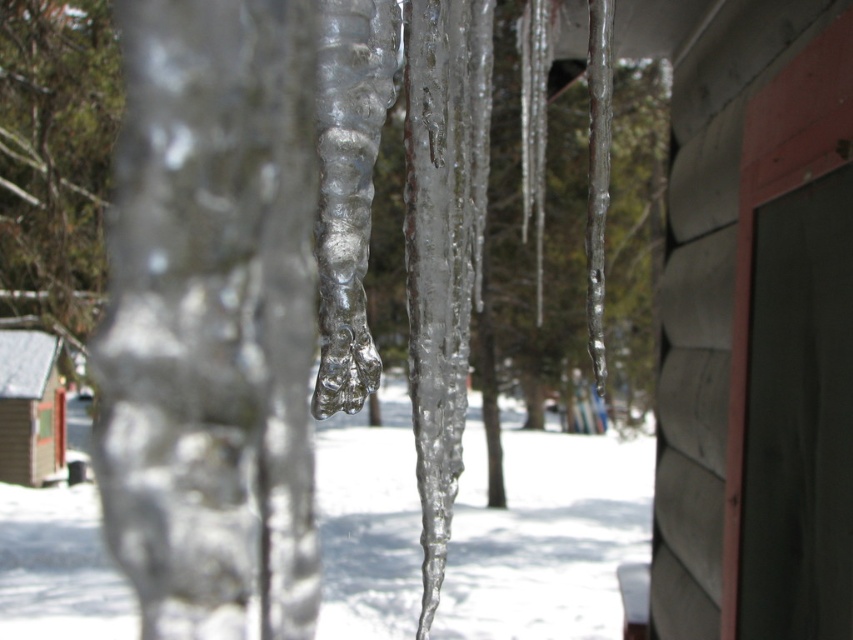
Question: Among these points, which one is nearest to the camera?

Choices:
 (A) (33, 374)
 (B) (27, 528)

Answer: (B)

Question: Among these objects, which one is nearest to the camera?

Choices:
 (A) wooden cabin at lower left
 (B) transparent ice icicles at center

Answer: (B)

Question: Is transparent ice icicles at center bigger than wooden cabin at lower left?

Choices:
 (A) no
 (B) yes

Answer: (A)

Question: Is transparent ice icicles at center bigger than wooden cabin at lower left?

Choices:
 (A) no
 (B) yes

Answer: (A)

Question: Is transparent ice icicles at center further to the viewer compared to wooden cabin at lower left?

Choices:
 (A) no
 (B) yes

Answer: (A)